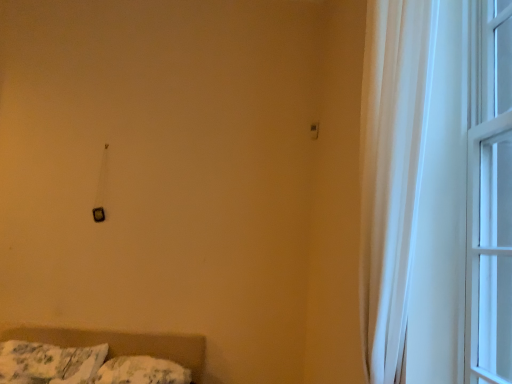
Question: Is the surface of fluffy white pillow at lower left, placed as the first pillow when sorted from left to right, in direct contact with fluffy white pillow at lower left, placed as the first pillow when sorted from right to left?

Choices:
 (A) no
 (B) yes

Answer: (A)

Question: From a real-world perspective, is fluffy white pillow at lower left, placed as the first pillow when sorted from left to right, under fluffy white pillow at lower left, the 2th pillow from the left?

Choices:
 (A) no
 (B) yes

Answer: (A)

Question: Does fluffy white pillow at lower left, placed as the first pillow when sorted from left to right, turn towards fluffy white pillow at lower left, the 2th pillow from the left?

Choices:
 (A) no
 (B) yes

Answer: (A)

Question: Can you confirm if fluffy white pillow at lower left, placed as the first pillow when sorted from left to right, is smaller than fluffy white pillow at lower left, placed as the first pillow when sorted from right to left?

Choices:
 (A) yes
 (B) no

Answer: (B)

Question: Can you confirm if fluffy white pillow at lower left, which is the second pillow in right-to-left order, is positioned to the left of fluffy white pillow at lower left, placed as the first pillow when sorted from right to left?

Choices:
 (A) yes
 (B) no

Answer: (A)

Question: In terms of width, does matte black switch at upper center look wider or thinner when compared to fluffy white pillow at lower left, placed as the first pillow when sorted from right to left?

Choices:
 (A) thin
 (B) wide

Answer: (A)

Question: From a real-world perspective, relative to fluffy white pillow at lower left, placed as the first pillow when sorted from right to left, is matte black switch at upper center vertically above or below?

Choices:
 (A) below
 (B) above

Answer: (B)

Question: Considering their positions, is matte black switch at upper center located in front of or behind fluffy white pillow at lower left, placed as the first pillow when sorted from right to left?

Choices:
 (A) front
 (B) behind

Answer: (B)

Question: Is matte black switch at upper center bigger or smaller than fluffy white pillow at lower left, the 2th pillow from the left?

Choices:
 (A) big
 (B) small

Answer: (B)

Question: Is fluffy white pillow at lower left, the 2th pillow from the left, taller or shorter than fluffy white pillow at lower left, placed as the first pillow when sorted from left to right?

Choices:
 (A) tall
 (B) short

Answer: (B)

Question: Considering the positions of fluffy white pillow at lower left, the 2th pillow from the left, and fluffy white pillow at lower left, which is the second pillow in right-to-left order, in the image, is fluffy white pillow at lower left, the 2th pillow from the left, wider or thinner than fluffy white pillow at lower left, which is the second pillow in right-to-left order,?

Choices:
 (A) wide
 (B) thin

Answer: (B)

Question: Does point pos(106,367) appear closer or farther from the camera than point pos(42,367)?

Choices:
 (A) closer
 (B) farther

Answer: (B)

Question: From a real-world perspective, is fluffy white pillow at lower left, placed as the first pillow when sorted from right to left, physically located above or below fluffy white pillow at lower left, which is the second pillow in right-to-left order?

Choices:
 (A) below
 (B) above

Answer: (A)

Question: Considering their positions, is white sheer curtain at right, acting as the second window starting from the right, located in front of or behind matte black switch at upper center?

Choices:
 (A) front
 (B) behind

Answer: (A)

Question: Looking at the image, does white sheer curtain at right, acting as the second window starting from the right, seem bigger or smaller compared to matte black switch at upper center?

Choices:
 (A) big
 (B) small

Answer: (A)